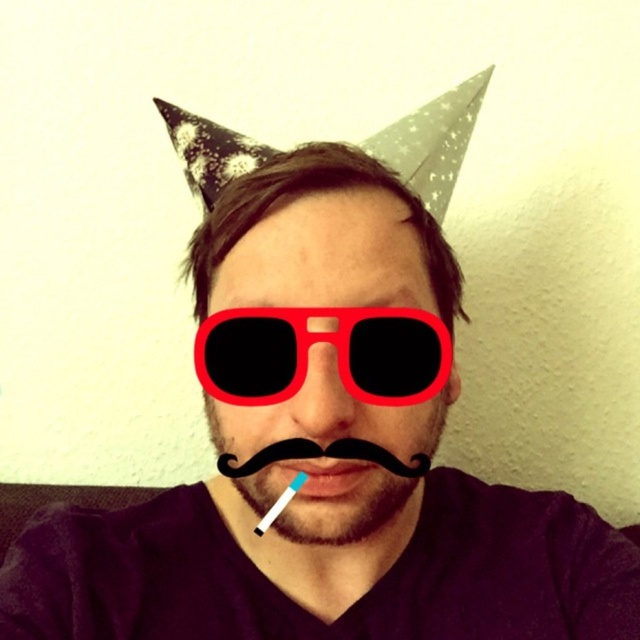
Who is higher up, red plastic sunglasses at center or matte plastic toothbrush at center?

red plastic sunglasses at center

Locate an element on the screen. The height and width of the screenshot is (640, 640). red plastic sunglasses at center is located at coordinates (326, 342).

Is red plastic sunglasses at center bigger than black fuzzy beard at center?

No, red plastic sunglasses at center is not bigger than black fuzzy beard at center.

Is red plastic sunglasses at center positioned at the back of black fuzzy beard at center?

Yes, red plastic sunglasses at center is behind black fuzzy beard at center.

Identify the location of red plastic sunglasses at center. The height and width of the screenshot is (640, 640). (326, 342).

This screenshot has height=640, width=640. In order to click on red plastic sunglasses at center in this screenshot , I will do `click(326, 342)`.

Can you confirm if black fuzzy beard at center is positioned to the left of matte plastic toothbrush at center?

No, black fuzzy beard at center is not to the left of matte plastic toothbrush at center.

Does black fuzzy beard at center have a lesser height compared to matte plastic toothbrush at center?

No, black fuzzy beard at center is not shorter than matte plastic toothbrush at center.

This screenshot has width=640, height=640. I want to click on black fuzzy beard at center, so click(x=333, y=467).